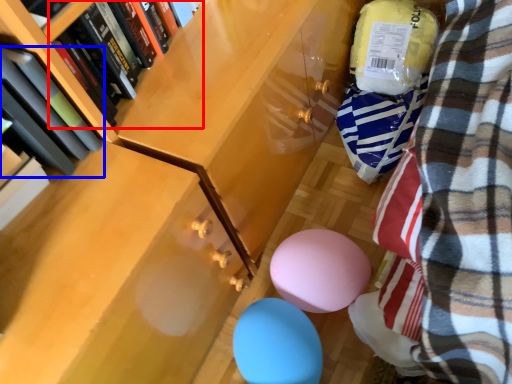
Question: Which of the following is the farthest to the observer, book (highlighted by a red box) or book (highlighted by a blue box)?

Choices:
 (A) book
 (B) book

Answer: (A)